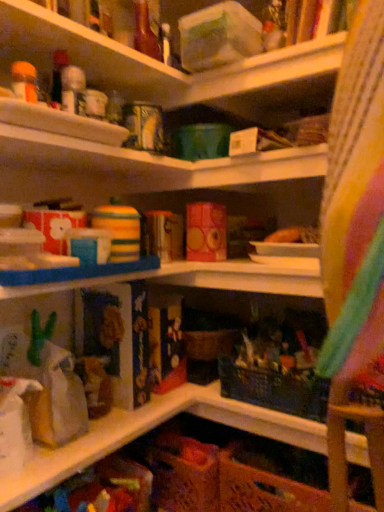
What is the approximate width of orange woven basket at lower center?

The width of orange woven basket at lower center is 11.74 inches.

At what (x,y) coordinates should I click in order to perform the action: click on orange woven basket at lower center. Please return your answer as a coordinate pair (x, y). The height and width of the screenshot is (512, 384). Looking at the image, I should click on (271, 479).

This screenshot has height=512, width=384. Describe the element at coordinates (271, 479) in the screenshot. I see `orange woven basket at lower center` at that location.

What is the approximate width of brown paper bag at lower left?

brown paper bag at lower left is 9.74 inches in width.

The image size is (384, 512). I want to click on brown paper bag at lower left, so (149, 430).

The width and height of the screenshot is (384, 512). Describe the element at coordinates (149, 430) in the screenshot. I see `brown paper bag at lower left` at that location.

Where is `orange woven basket at lower center`? orange woven basket at lower center is located at coordinates (271, 479).

Considering the relative positions of brown paper bag at lower left and orange woven basket at lower center in the image provided, is brown paper bag at lower left to the left of orange woven basket at lower center from the viewer's perspective?

Indeed, brown paper bag at lower left is positioned on the left side of orange woven basket at lower center.

Is the position of brown paper bag at lower left less distant than that of orange woven basket at lower center?

Yes, brown paper bag at lower left is closer to the viewer.

Which is farther, (67, 463) or (236, 494)?

Point (236, 494)

From the image's perspective, relative to orange woven basket at lower center, is brown paper bag at lower left above or below?

From the image's perspective, brown paper bag at lower left appears above orange woven basket at lower center.

From a real-world perspective, is brown paper bag at lower left over orange woven basket at lower center?

Yes, from a real-world perspective, brown paper bag at lower left is over orange woven basket at lower center

Considering the sizes of objects brown paper bag at lower left and orange woven basket at lower center in the image provided, who is wider, brown paper bag at lower left or orange woven basket at lower center?

Wider between the two is orange woven basket at lower center.

Which of these two, brown paper bag at lower left or orange woven basket at lower center, stands taller?

orange woven basket at lower center.

Considering the sizes of objects brown paper bag at lower left and orange woven basket at lower center in the image provided, who is smaller, brown paper bag at lower left or orange woven basket at lower center?

brown paper bag at lower left.

Can we say brown paper bag at lower left lies outside orange woven basket at lower center?

Yes.

Can you see brown paper bag at lower left touching orange woven basket at lower center?

brown paper bag at lower left and orange woven basket at lower center are not in contact.

Is brown paper bag at lower left looking in the opposite direction of orange woven basket at lower center?

No, brown paper bag at lower left's orientation is not away from orange woven basket at lower center.

I want to click on basket on the right of brown paper bag at lower left, so click(x=271, y=479).

Can you confirm if orange woven basket at lower center is positioned to the left of brown paper bag at lower left?

Incorrect, orange woven basket at lower center is not on the left side of brown paper bag at lower left.

Is orange woven basket at lower center in front of or behind brown paper bag at lower left in the image?

orange woven basket at lower center is positioned farther from the viewer than brown paper bag at lower left.

Is point (258, 467) positioned before point (5, 478)?

No, (258, 467) is behind (5, 478).

From the picture: From the image's perspective, who appears lower, orange woven basket at lower center or brown paper bag at lower left?

From the image's view, orange woven basket at lower center is below.

From a real-world perspective, is orange woven basket at lower center over brown paper bag at lower left?

No.

From the picture: Between orange woven basket at lower center and brown paper bag at lower left, which one has smaller width?

brown paper bag at lower left is thinner.

From the picture: Considering the relative sizes of orange woven basket at lower center and brown paper bag at lower left in the image provided, is orange woven basket at lower center taller than brown paper bag at lower left?

Correct, orange woven basket at lower center is much taller as brown paper bag at lower left.

Between orange woven basket at lower center and brown paper bag at lower left, which one has smaller size?

With smaller size is brown paper bag at lower left.

Could brown paper bag at lower left be considered to be inside orange woven basket at lower center?

No, brown paper bag at lower left is not inside orange woven basket at lower center.

Is orange woven basket at lower center positioned far away from brown paper bag at lower left?

No, orange woven basket at lower center is not far away from brown paper bag at lower left.

Is brown paper bag at lower left at the back of orange woven basket at lower center?

No, orange woven basket at lower center is not facing the opposite direction of brown paper bag at lower left.

Can you tell me how much orange woven basket at lower center and brown paper bag at lower left differ in facing direction?

91 degrees separate the facing orientations of orange woven basket at lower center and brown paper bag at lower left.

Find the location of a particular element. This screenshot has height=512, width=384. basket behind the brown paper bag at lower left is located at coordinates (271, 479).

Find the location of a particular element. The width and height of the screenshot is (384, 512). basket below the brown paper bag at lower left (from the image's perspective) is located at coordinates (271, 479).

At what (x,y) coordinates should I click in order to perform the action: click on basket below the brown paper bag at lower left (from a real-world perspective). Please return your answer as a coordinate pair (x, y). Image resolution: width=384 pixels, height=512 pixels. Looking at the image, I should click on (271, 479).